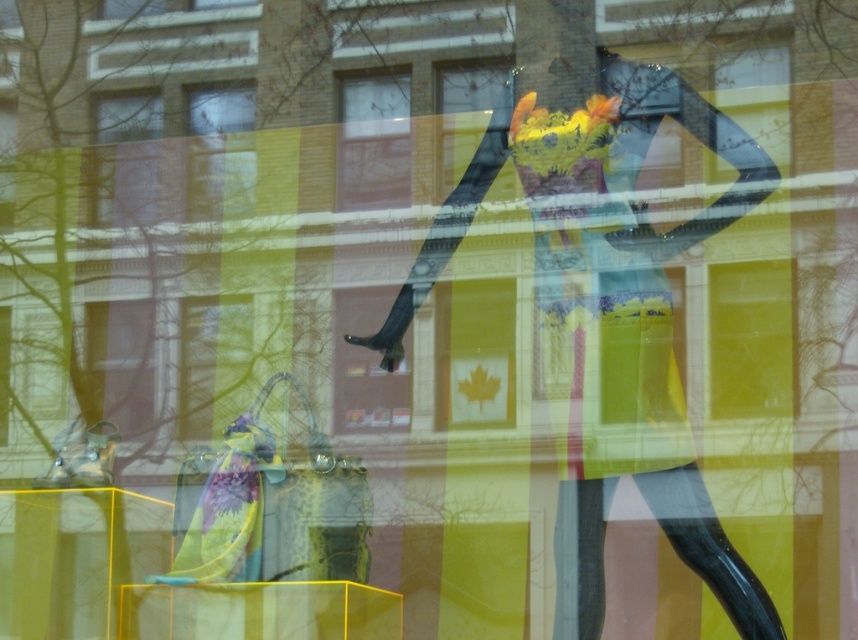
Does point (527, 129) come closer to viewer compared to point (95, 211)?

Yes, it is in front of point (95, 211).

Is floral silk dress at center closer to the viewer compared to clear glass window at upper left?

That is True.

Which is behind, point (663, 460) or point (136, 182)?

The point (136, 182) is more distant.

Where is `floral silk dress at center`? The height and width of the screenshot is (640, 858). floral silk dress at center is located at coordinates (597, 296).

Does matte glass window at upper center appear on the left side of matte black dress at center?

Correct, you'll find matte glass window at upper center to the left of matte black dress at center.

Can you confirm if matte glass window at upper center is shorter than matte black dress at center?

No.

Locate an element on the screen. Image resolution: width=858 pixels, height=640 pixels. matte glass window at upper center is located at coordinates (221, 152).

Can you confirm if matte yellow purse at center is bigger than clear glass window at upper left?

Yes, matte yellow purse at center is bigger than clear glass window at upper left.

Locate an element on the screen. matte yellow purse at center is located at coordinates (213, 364).